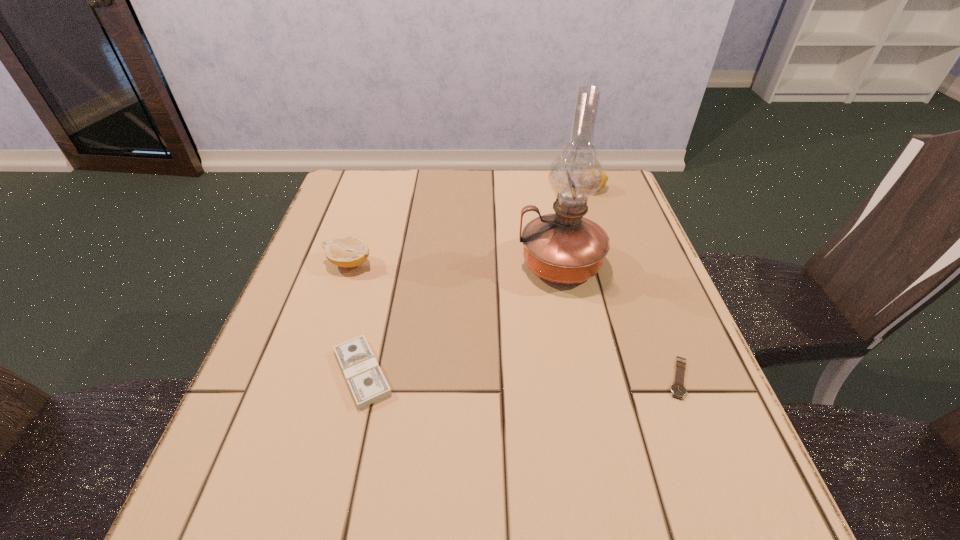
The width and height of the screenshot is (960, 540). Find the location of `object located in the far right corner section of the desktop`. object located in the far right corner section of the desktop is located at coordinates (605, 179).

The width and height of the screenshot is (960, 540). I want to click on free space at the far edge of the desktop, so click(x=422, y=206).

This screenshot has height=540, width=960. I want to click on vacant space at the left edge of the desktop, so click(334, 302).

Locate an element on the screen. free location at the right edge of the desktop is located at coordinates (648, 295).

Image resolution: width=960 pixels, height=540 pixels. What are the coordinates of `free space at the far right corner of the desktop` in the screenshot? It's located at (615, 177).

Locate an element on the screen. The width and height of the screenshot is (960, 540). free area in between the third shortest object and the watch is located at coordinates (515, 320).

The width and height of the screenshot is (960, 540). I want to click on vacant area that lies between the oil lamp and the fourth tallest object, so click(x=462, y=318).

Identify the location of free space between the taller lemon and the dollar. This screenshot has height=540, width=960. (477, 281).

Find the location of a particular element. The image size is (960, 540). empty space that is in between the third tallest object and the watch is located at coordinates (515, 320).

Image resolution: width=960 pixels, height=540 pixels. I want to click on free space between the fourth tallest object and the oil lamp, so click(x=462, y=318).